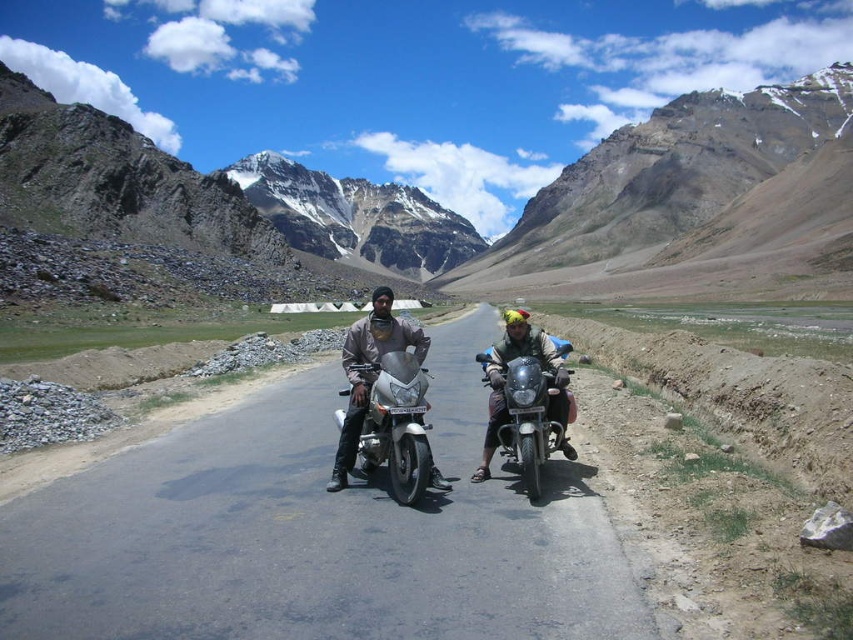
Question: Where is shiny metallic motorcycle at center located in relation to matte silver motorcycle at center in the image?

Choices:
 (A) below
 (B) above

Answer: (A)

Question: Is rocky gray mountain at center below shiny metallic motorcycle at center?

Choices:
 (A) yes
 (B) no

Answer: (B)

Question: Among these objects, which one is nearest to the camera?

Choices:
 (A) shiny metallic motorcycle at center
 (B) silver metallic motorcycle at center
 (C) asphalt road at center
 (D) rocky gray mountain at center

Answer: (C)

Question: Which object is positioned closest to the asphalt road at center?

Choices:
 (A) shiny metallic motorcycle at center
 (B) silver metallic motorcycle at center
 (C) rugged stone mountain at upper center

Answer: (B)

Question: Does asphalt road at center have a smaller size compared to silver metallic motorcycle at center?

Choices:
 (A) no
 (B) yes

Answer: (A)

Question: Which point appears closest to the camera in this image?

Choices:
 (A) (643, 132)
 (B) (403, 380)
 (C) (552, 280)

Answer: (B)